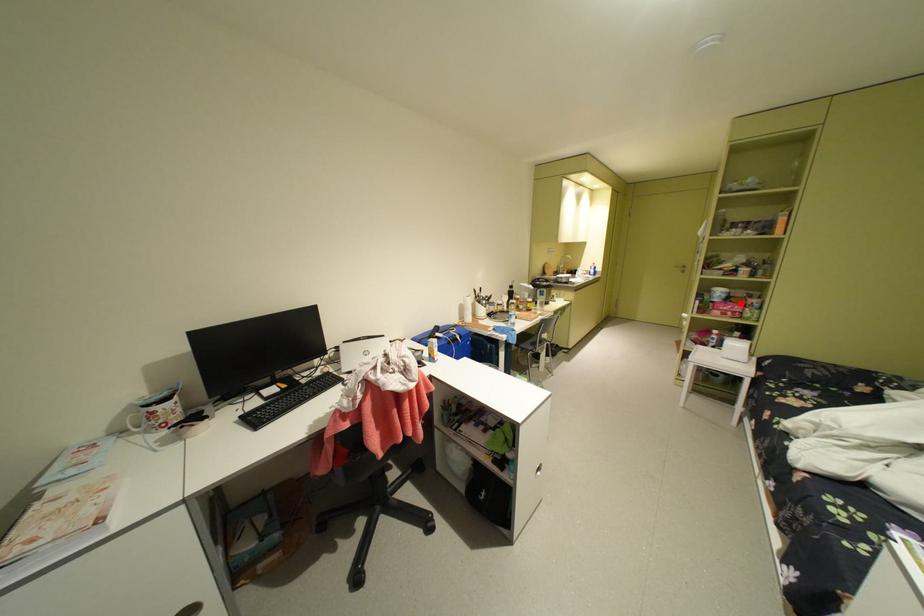
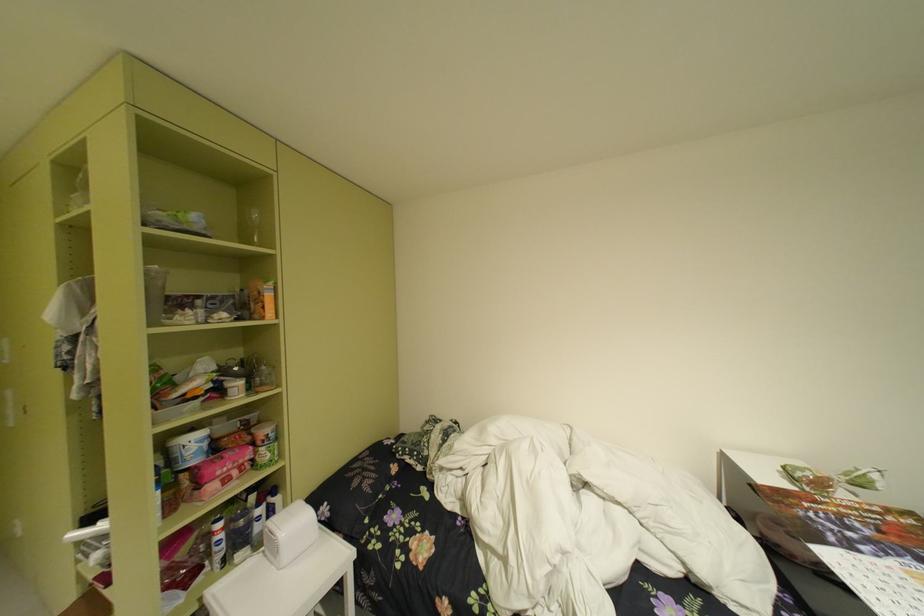
Where in the second image is the point corresponding to the highlighted location from the first image?

(238, 455)